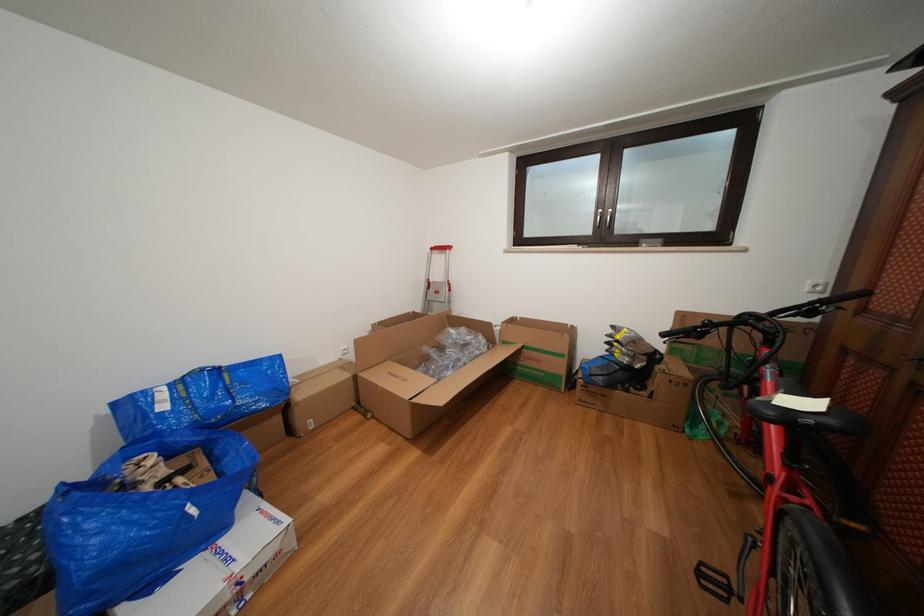
Where would you sit the black bicycle saddle? Please return your answer as a coordinate pair (x, y).

(786, 405)